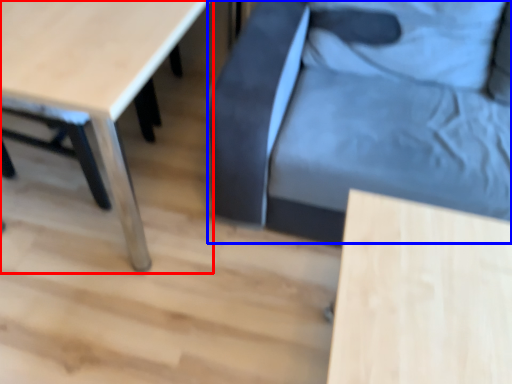
Question: Which object is closer to the camera taking this photo, table (highlighted by a red box) or swivel chair (highlighted by a blue box)?

Choices:
 (A) table
 (B) swivel chair

Answer: (A)